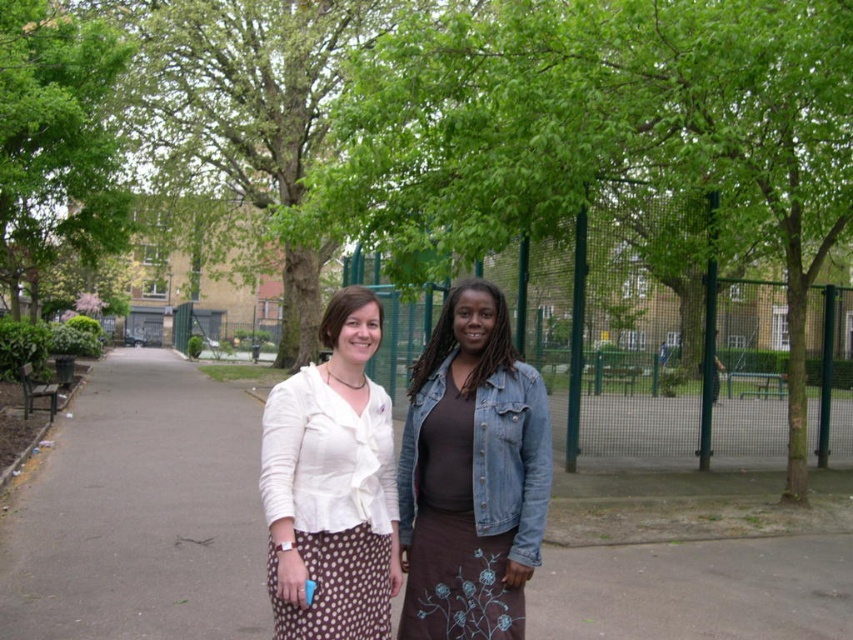
Question: Which of these objects is positioned farthest from the white satin blouse at center?

Choices:
 (A) green leafy tree at center
 (B) denim jacket at center

Answer: (A)

Question: Which object is the farthest from the green leafy tree at upper left?

Choices:
 (A) white satin blouse at center
 (B) denim jacket at center

Answer: (A)

Question: Is green leafy tree at center wider than denim jacket at center?

Choices:
 (A) yes
 (B) no

Answer: (B)

Question: Observing the image, what is the correct spatial positioning of white satin blouse at center in reference to green leafy tree at upper left?

Choices:
 (A) below
 (B) above

Answer: (A)

Question: Is green leafy tree at center wider than brown asphalt at center?

Choices:
 (A) no
 (B) yes

Answer: (A)

Question: Which point is farther to the camera?

Choices:
 (A) (100, 77)
 (B) (386, 204)
 (C) (306, 472)

Answer: (A)